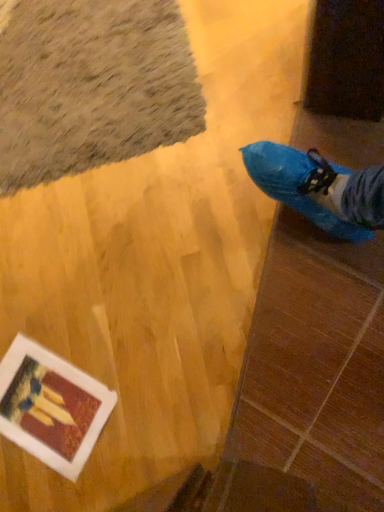
Describe the element at coordinates (51, 406) in the screenshot. I see `white matte painting at lower left` at that location.

Where is `white matte painting at lower left`? This screenshot has height=512, width=384. white matte painting at lower left is located at coordinates (51, 406).

Find the location of a particular element. white matte painting at lower left is located at coordinates (51, 406).